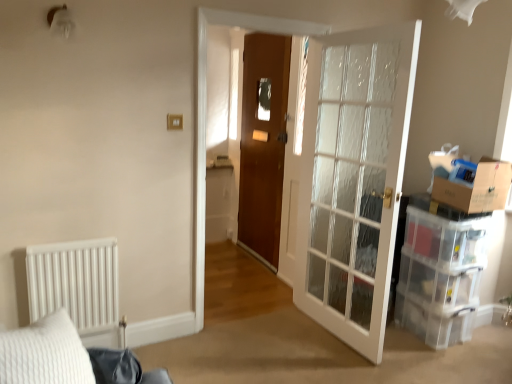
This screenshot has height=384, width=512. I want to click on vacant space in front of wooden door at center, so click(253, 277).